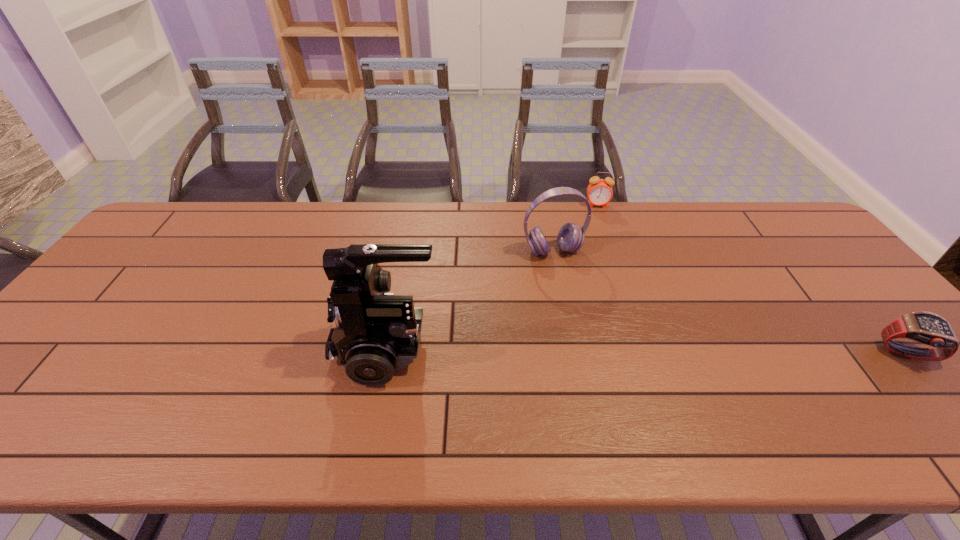
I want to click on free space located 0.180m on the lens mount of the camcorder, so pyautogui.click(x=258, y=348).

This screenshot has height=540, width=960. I want to click on vacant space located on the left of the shortest object, so click(809, 354).

Find the location of a particular element. This screenshot has height=540, width=960. vacant space located 0.390m on the headband and ear cups of the third object from right to left is located at coordinates (614, 370).

Find the location of `vacant space located 0.360m on the headband and ear cups of the third object from right to left`. vacant space located 0.360m on the headband and ear cups of the third object from right to left is located at coordinates (610, 360).

The width and height of the screenshot is (960, 540). Identify the location of free spot located on the headband and ear cups of the third object from right to left. (588, 317).

This screenshot has width=960, height=540. I want to click on free region located 0.360m on the face of the farthest object, so click(604, 281).

At what (x,y) coordinates should I click in order to perform the action: click on free space located on the face of the farthest object. Please return your answer as a coordinate pair (x, y). The height and width of the screenshot is (540, 960). Looking at the image, I should click on pos(601,256).

Locate an element on the screen. vacant space located on the face of the farthest object is located at coordinates (600, 246).

Locate an element on the screen. The height and width of the screenshot is (540, 960). headset that is at the far edge is located at coordinates (570, 238).

Where is `alarm clock present at the far edge`? alarm clock present at the far edge is located at coordinates (599, 191).